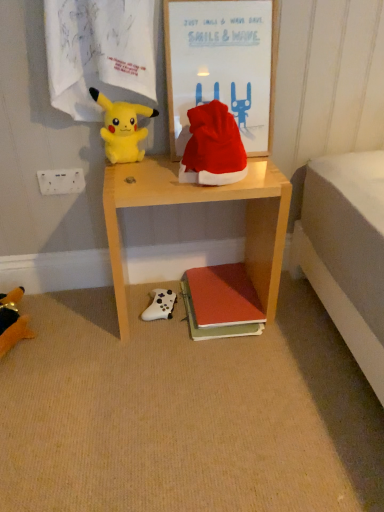
Where is `free space to the right of soft plush toy at lower left, placed as the first toy when sorted from bottom to top`? free space to the right of soft plush toy at lower left, placed as the first toy when sorted from bottom to top is located at coordinates (79, 341).